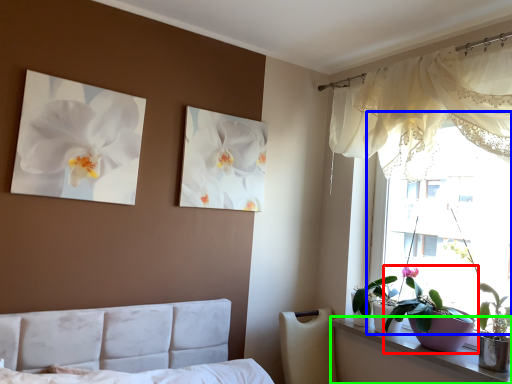
Question: Based on their relative distances, which object is farther from houseplant (highlighted by a red box)? Choose from window (highlighted by a blue box) and window sill (highlighted by a green box).

Choices:
 (A) window
 (B) window sill

Answer: (A)